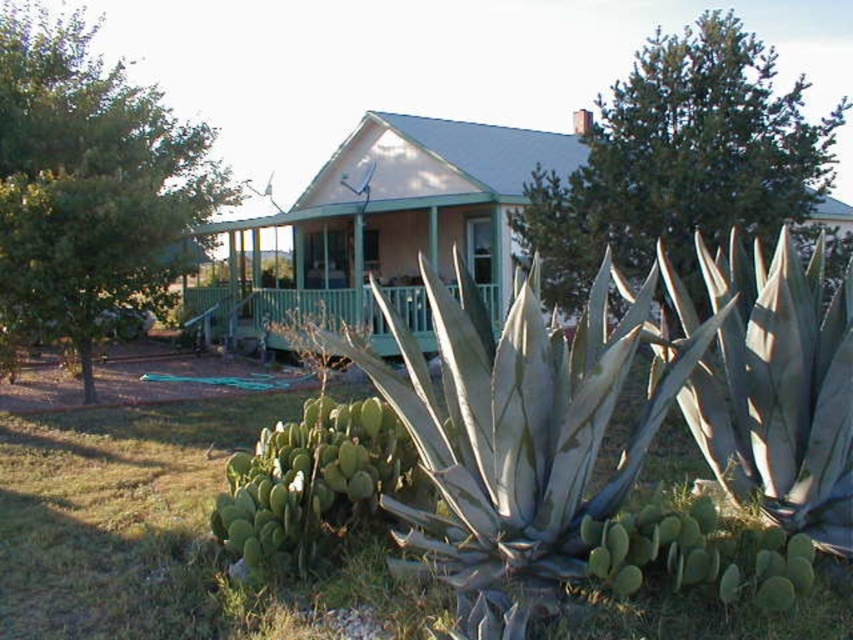
Question: Is green leafy tree at left positioned before green wood porch at center?

Choices:
 (A) no
 (B) yes

Answer: (B)

Question: Is the position of green leafy tree at left more distant than that of green wood porch at center?

Choices:
 (A) yes
 (B) no

Answer: (B)

Question: Among these objects, which one is farthest from the camera?

Choices:
 (A) green leafy tree at left
 (B) green wood porch at center
 (C) green leafy tree at upper center

Answer: (B)

Question: Is green leafy tree at upper center smaller than green wood porch at center?

Choices:
 (A) yes
 (B) no

Answer: (B)

Question: Which of these objects is positioned farthest from the green leafy tree at upper center?

Choices:
 (A) green leafy tree at left
 (B) green wood porch at center

Answer: (B)

Question: Which object is closer to the camera taking this photo?

Choices:
 (A) green leafy tree at upper center
 (B) green wood porch at center
 (C) green leafy tree at left

Answer: (A)